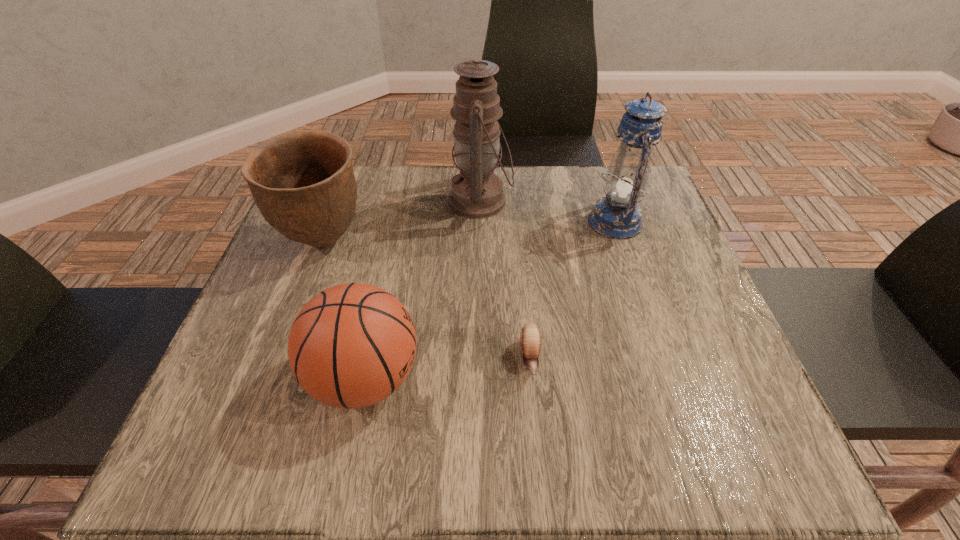
Identify the location of oil lamp. The width and height of the screenshot is (960, 540). (476, 192).

Locate an element on the screen. The image size is (960, 540). lantern is located at coordinates (617, 216).

I want to click on pottery, so coord(303,183).

Find the location of `basketball`. basketball is located at coordinates (352, 345).

This screenshot has width=960, height=540. In order to click on escargot in this screenshot , I will do (530, 340).

At what (x,y) coordinates should I click in order to perform the action: click on vacant space located 0.360m on the right of the oil lamp. Please return your answer as a coordinate pair (x, y). Image resolution: width=960 pixels, height=540 pixels. Looking at the image, I should click on (657, 201).

The height and width of the screenshot is (540, 960). Identify the location of vacant region located 0.390m on the front-facing side of the rightmost object. (424, 222).

Identify the location of free location located on the front-facing side of the rightmost object. The width and height of the screenshot is (960, 540). (513, 222).

The width and height of the screenshot is (960, 540). Identify the location of free space located 0.130m on the front-facing side of the rightmost object. (534, 222).

This screenshot has height=540, width=960. What are the coordinates of `vacant space located 0.090m on the back of the pottery` in the screenshot? It's located at (343, 192).